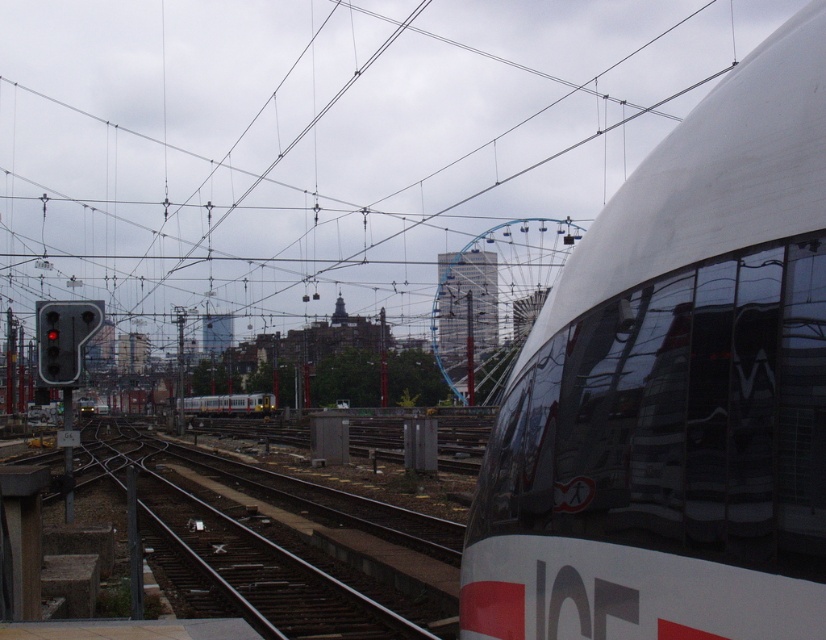
Looking at this image, you are standing in the railway yard and looking at the scene described. Where exactly is the metallic wire at upper center located in terms of coordinates?

The metallic wire at upper center is located at coordinates point (317, 145).

You are standing at the railway yard and want to take a photo of the two points mentioned. Which point, point (335, 93) or point (43, 310), is closer to you when you are facing the scene?

Point (43, 310) is closer to you because it is less further to the camera than point (335, 93).